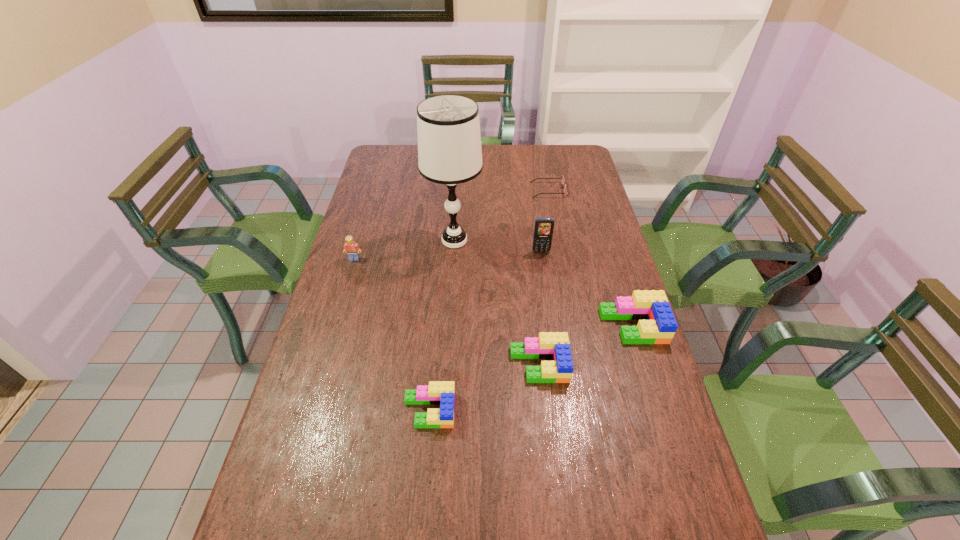
At what (x,y) coordinates should I click in order to perform the action: click on sunglasses. Please return your answer as a coordinate pair (x, y). The width and height of the screenshot is (960, 540). Looking at the image, I should click on (562, 178).

You are a GUI agent. You are given a task and a screenshot of the screen. Output one action in this format:
    pyautogui.click(x=<x>, y=<y>)
    Task: Click on the shortest object
    The height and width of the screenshot is (540, 960).
    Given the screenshot: What is the action you would take?
    pyautogui.click(x=562, y=178)

Identify the location of free spot located 0.220m on the left of the sixth tallest object. click(x=316, y=410).

The height and width of the screenshot is (540, 960). I want to click on vacant area situated 0.220m on the back of the fifth tallest object, so click(531, 290).

Identify the location of blank space located 0.300m on the left of the rightmost Lego. (499, 326).

At what (x,y) coordinates should I click in order to perform the action: click on blank space located 0.060m on the back of the table lamp. Please return your answer as a coordinate pair (x, y). This screenshot has height=540, width=960. Looking at the image, I should click on (456, 213).

Where is `free region located 0.100m on the screen of the sixth shortest object`? free region located 0.100m on the screen of the sixth shortest object is located at coordinates (544, 274).

At what (x,y) coordinates should I click in order to perform the action: click on vacant area situated on the front-facing side of the leftmost Lego. Please return your answer as a coordinate pair (x, y). This screenshot has width=960, height=540. Looking at the image, I should click on [x=340, y=308].

The image size is (960, 540). I want to click on blank area located 0.050m on the bridge of the farthest object, so click(x=519, y=190).

Identify the location of vacant space located 0.350m on the bridge of the farthest object. (444, 190).